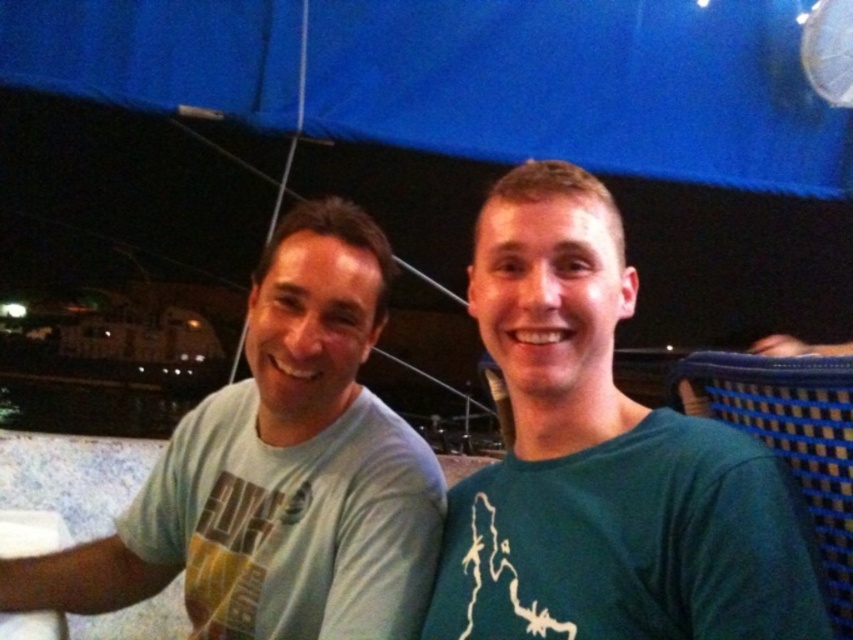
Between point (614, 529) and point (378, 253), which one is positioned behind?

The point (378, 253) is more distant.

Which of these two, light blue cotton shirt at center or light blue cotton shirt at left, stands taller?

light blue cotton shirt at left

Does point (592, 192) lie in front of point (287, 493)?

Yes, it is.

The height and width of the screenshot is (640, 853). Find the location of `light blue cotton shirt at center`. light blue cotton shirt at center is located at coordinates (604, 460).

Is light blue cotton shirt at center to the left of green matte shirt at right from the viewer's perspective?

Yes, light blue cotton shirt at center is to the left of green matte shirt at right.

Is light blue cotton shirt at center further to the viewer compared to green matte shirt at right?

Yes, light blue cotton shirt at center is behind green matte shirt at right.

Is point (456, 616) closer to viewer compared to point (422, 636)?

Yes, point (456, 616) is in front of point (422, 636).

Locate an element on the screen. Image resolution: width=853 pixels, height=640 pixels. light blue cotton shirt at center is located at coordinates click(604, 460).

Is green matte shirt at right closer to camera compared to light blue cotton shirt at left?

Yes, green matte shirt at right is closer to the viewer.

Is point (619, 586) positioned behind point (334, 317)?

No.

Locate an element on the screen. The image size is (853, 640). green matte shirt at right is located at coordinates (604, 461).

This screenshot has width=853, height=640. I want to click on green matte shirt at right, so click(x=604, y=461).